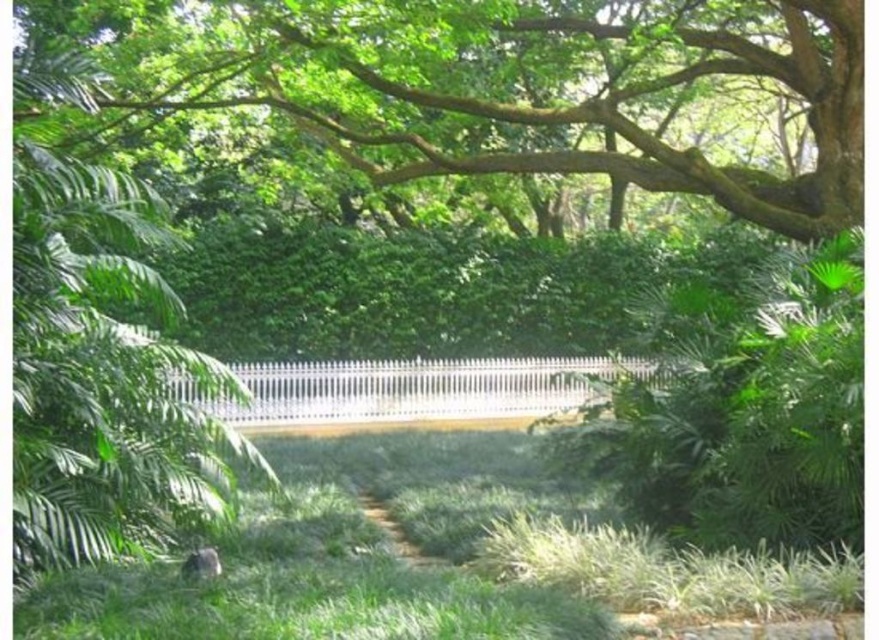
Based on the photo, you are standing at the point marked as point (344, 554) in the garden. What is the name of the object you are currently standing on?

The green grass at center is located at point (344, 554), so you are standing on the green grass at center.

In the scene shown: What is located at the coordinates point (98, 353) in the garden scene?

The coordinates point (98, 353) indicate the location of a green leafy tree at center in the garden scene.

What are the coordinates of the green leafy tree at center in the image?

The green leafy tree at center is located at coordinates point (98, 353).